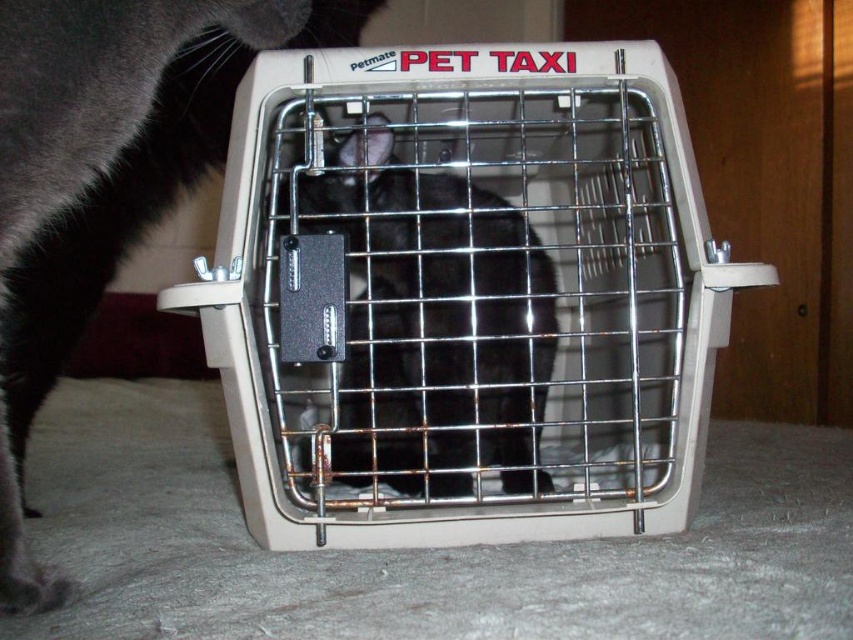
You are a pet sitter who needs to place a new cat toy inside the beige plastic pet taxi at center where the black matte fur cat at center can reach it. Based on their sizes, where should you place the toy?

Since the beige plastic pet taxi at center is larger than the black matte fur cat at center, placing the toy near the entrance of the carrier would ensure the cat can easily reach it without needing to stretch too far inside the larger space.

You are a pet owner who wants to ensure the safety of both cats. Based on the scene, which cat is closer to you, the black fur cat at center or the black matte fur cat at center?

The black fur cat at center is closer to you since it is in front of the black matte fur cat at center.

You are a pet owner trying to move the beige plastic pet taxi at center to the left side of the black matte fur cat at center. Is this possible given their current positions?

The beige plastic pet taxi at center is currently on the right side of the black matte fur cat at center, so moving it to the left side would require shifting its position to the opposite side of the cat.